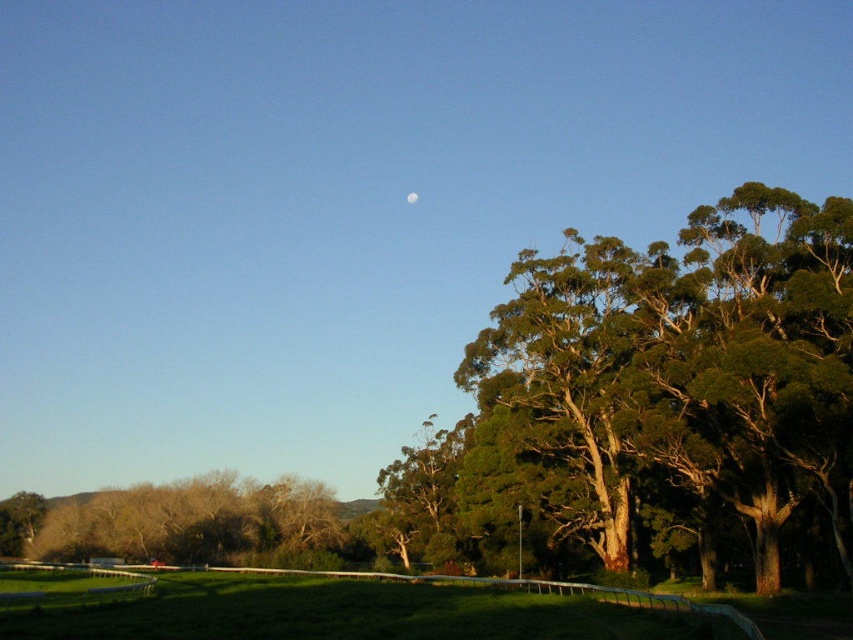
You are an astronomer analyzing the image. The green textured tree at upper right is blocking your view of the moon. Can you estimate the moon position relative to the tree based on the shadow direction and the tree location?

The moon is positioned to the left of the green textured tree at upper right because the shadows cast by the fence indicate the light source is coming from the lower right, opposite the moon.

Based on the scene, which tree, the green textured tree at upper right or the green leafy tree at lower left, would cast a longer shadow on the grass?

The green textured tree at upper right would cast a longer shadow because it has a larger size compared to the green leafy tree at lower left.

You are standing in the middle of the grassy field between the green textured tree at upper right and the green leafy tree at lower left. Which tree appears taller from your perspective?

The green textured tree at upper right appears taller than the green leafy tree at lower left because it has a greater height compared to it.